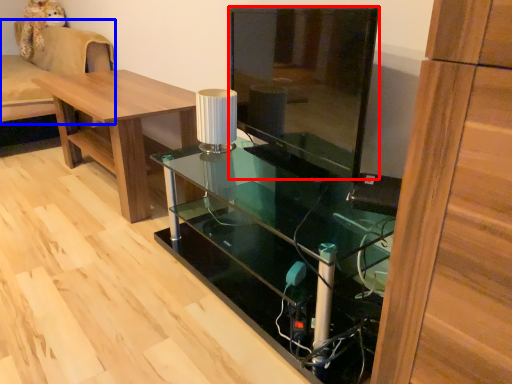
Question: Which point is closer to the camera, glass door (highlighted by a red box) or couch (highlighted by a blue box)?

Choices:
 (A) glass door
 (B) couch

Answer: (A)